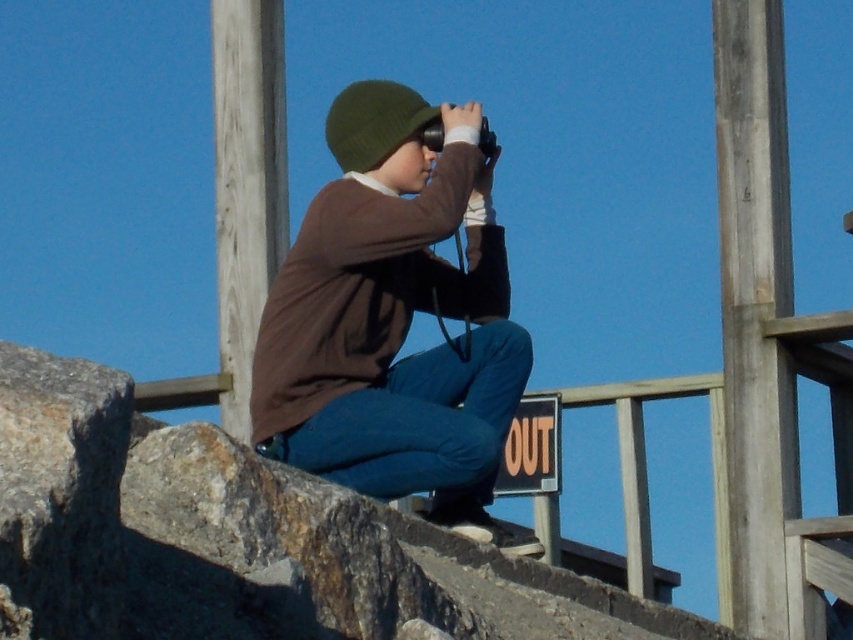
Is brown cotton shirt at center to the left of green woolen hat at center from the viewer's perspective?

Incorrect, brown cotton shirt at center is not on the left side of green woolen hat at center.

Between brown cotton shirt at center and green woolen hat at center, which one appears on the right side from the viewer's perspective?

brown cotton shirt at center

Where is `brown cotton shirt at center`? brown cotton shirt at center is located at coordinates (393, 317).

Who is higher up, smooth wood pole at upper left or green woolen hat at center?

green woolen hat at center is above.

Can you confirm if smooth wood pole at upper left is taller than green woolen hat at center?

Indeed, smooth wood pole at upper left has a greater height compared to green woolen hat at center.

This screenshot has width=853, height=640. Identify the location of smooth wood pole at upper left. (247, 182).

Image resolution: width=853 pixels, height=640 pixels. I want to click on smooth wood pole at upper left, so click(x=247, y=182).

Can you confirm if smooth gray pole at upper right is thinner than smooth wood pole at upper left?

Correct, smooth gray pole at upper right's width is less than smooth wood pole at upper left's.

Based on the photo, is smooth gray pole at upper right to the left of smooth wood pole at upper left from the viewer's perspective?

No, smooth gray pole at upper right is not to the left of smooth wood pole at upper left.

Which is in front, point (729, 28) or point (274, 108)?

Positioned in front is point (729, 28).

At what (x,y) coordinates should I click in order to perform the action: click on smooth gray pole at upper right. Please return your answer as a coordinate pair (x, y). The height and width of the screenshot is (640, 853). Looking at the image, I should click on (755, 307).